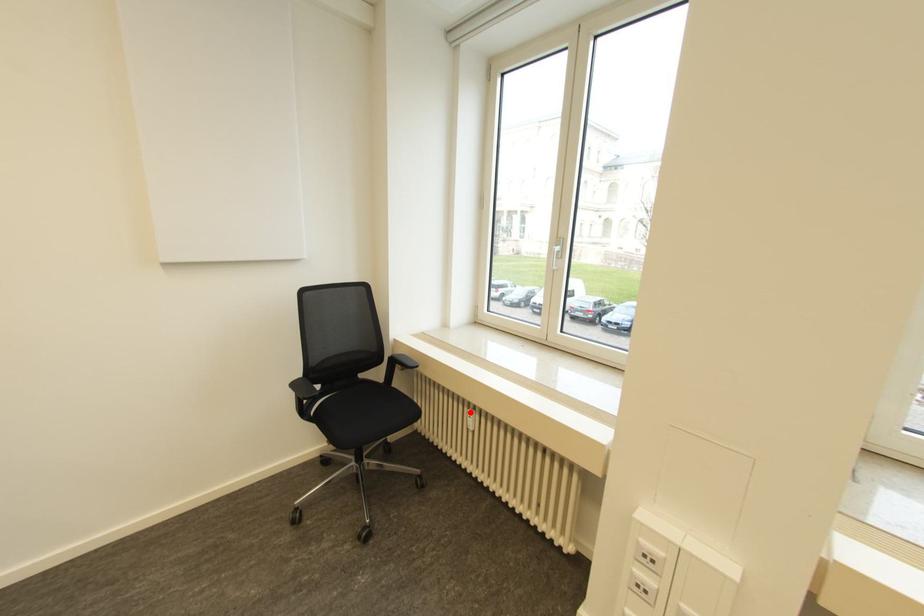
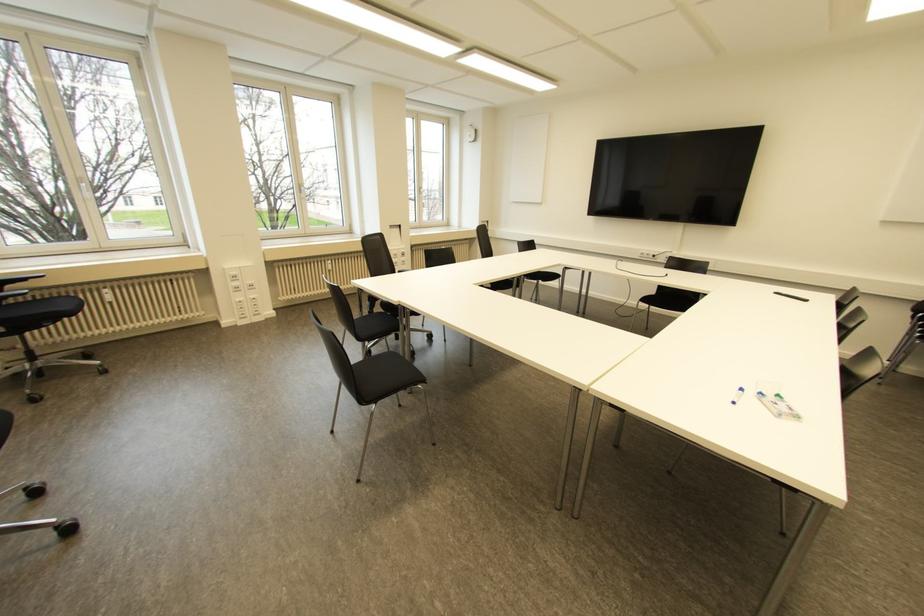
Question: I am providing you with two images of the same scene from different viewpoints. A red point is marked on the first image. Is the red point's position out of view in image 2?

Choices:
 (A) Yes
 (B) No

Answer: (B)